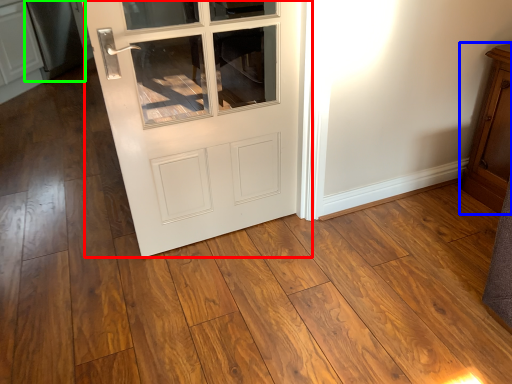
Question: Considering the real-world distances, which object is farthest from door (highlighted by a red box)? dresser (highlighted by a blue box) or appliance (highlighted by a green box)?

Choices:
 (A) dresser
 (B) appliance

Answer: (B)